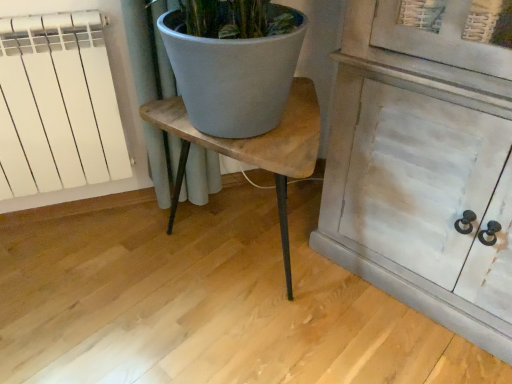
Question: From the image's perspective, is wooden table at center above or below white matte radiator at left?

Choices:
 (A) above
 (B) below

Answer: (B)

Question: Is wooden table at center inside or outside of white matte radiator at left?

Choices:
 (A) outside
 (B) inside

Answer: (A)

Question: Is wooden table at center taller or shorter than white matte radiator at left?

Choices:
 (A) short
 (B) tall

Answer: (A)

Question: From a real-world perspective, relative to wooden table at center, is white matte radiator at left vertically above or below?

Choices:
 (A) below
 (B) above

Answer: (B)

Question: Relative to wooden table at center, is white matte radiator at left in front or behind?

Choices:
 (A) behind
 (B) front

Answer: (A)

Question: Considering the positions of white matte radiator at left and wooden table at center in the image, is white matte radiator at left wider or thinner than wooden table at center?

Choices:
 (A) wide
 (B) thin

Answer: (B)

Question: From their relative heights in the image, would you say white matte radiator at left is taller or shorter than wooden table at center?

Choices:
 (A) tall
 (B) short

Answer: (A)